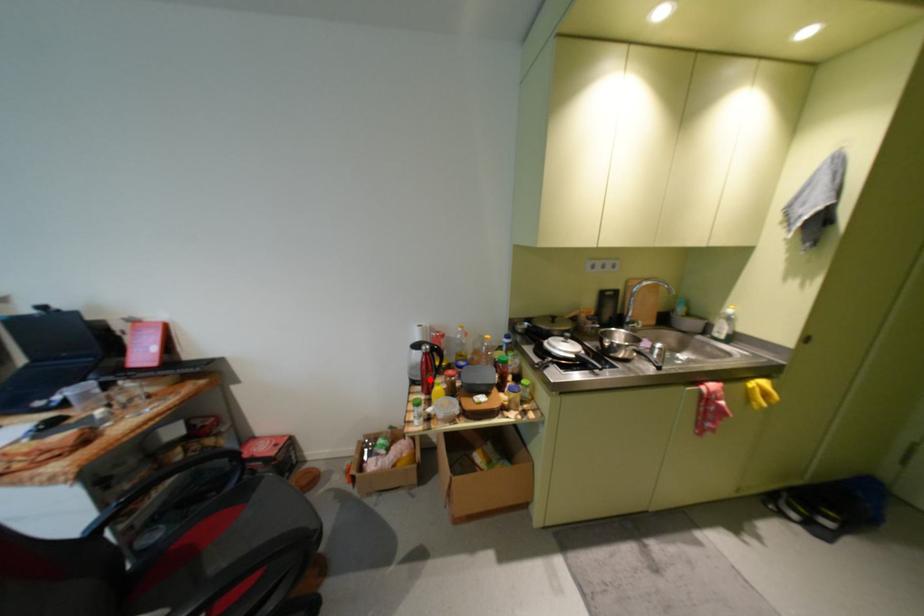
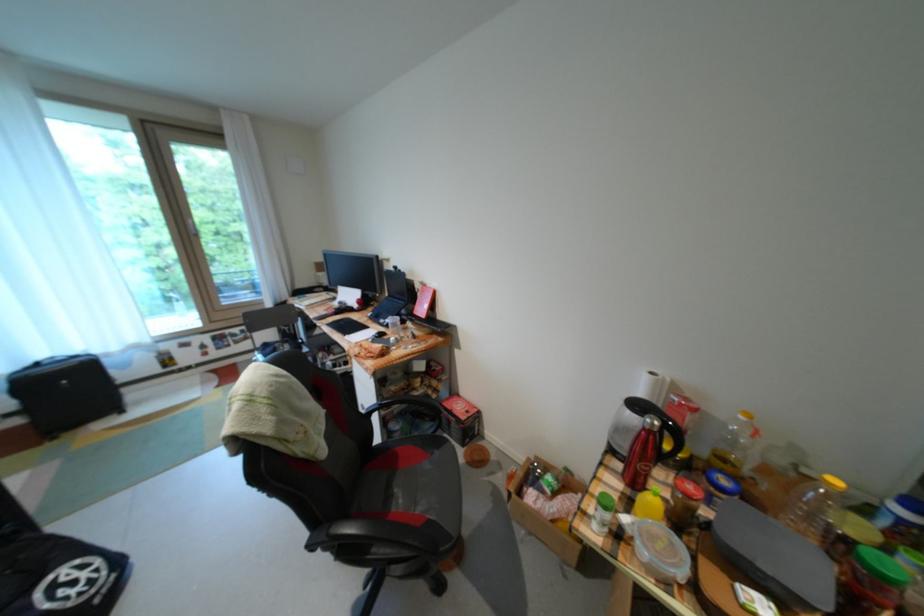
Find the pixel in the second image that matches the highlighted location in the first image.

(636, 455)